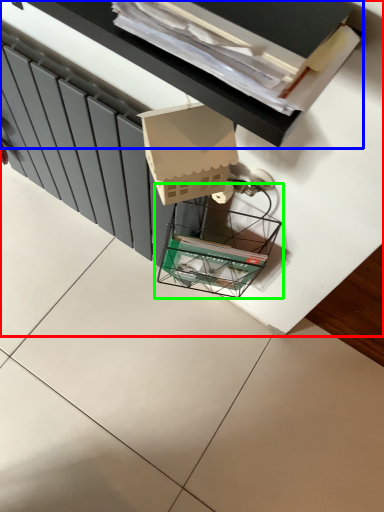
Question: Which object is the closest to the furniture (highlighted by a red box)? Choose among these: vanity (highlighted by a blue box) or glass box (highlighted by a green box).

Choices:
 (A) vanity
 (B) glass box

Answer: (B)